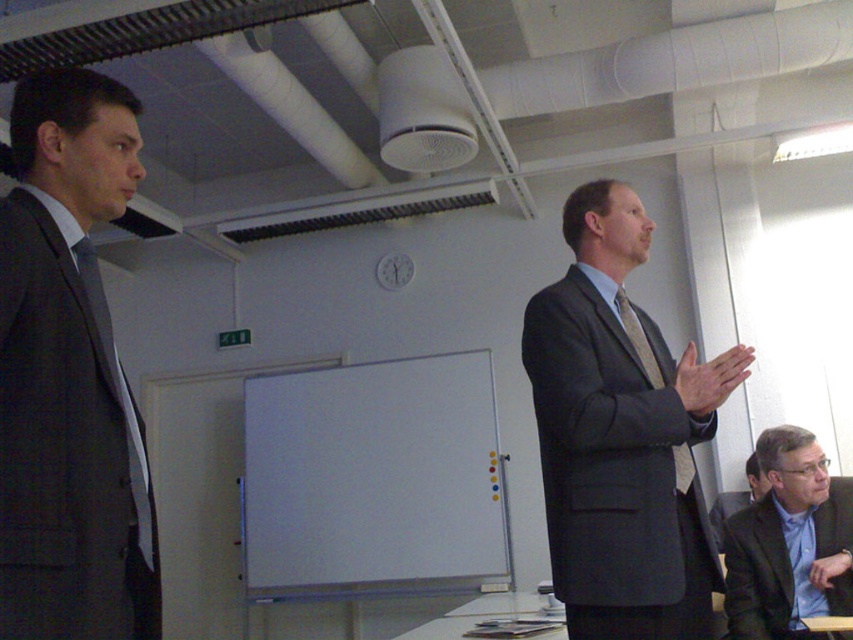
Question: Which object is positioned farthest from the matte gray suit at center?

Choices:
 (A) matte gray suit at left
 (B) dark gray suit at right

Answer: (B)

Question: Which of the following is the closest to the observer?

Choices:
 (A) (125, 628)
 (B) (753, 467)
 (C) (548, 477)
 (D) (787, 496)

Answer: (A)

Question: Can you confirm if matte gray suit at left is positioned below matte gray suit at center?

Choices:
 (A) no
 (B) yes

Answer: (A)

Question: Observing the image, what is the correct spatial positioning of matte gray suit at left in reference to matte gray suit at center?

Choices:
 (A) right
 (B) left

Answer: (B)

Question: Estimate the real-world distances between objects in this image. Which object is farther from the blue shirt at center?

Choices:
 (A) matte gray suit at center
 (B) matte gray suit at left
 (C) dark gray suit at right

Answer: (B)

Question: Does matte gray suit at left appear on the right side of blue shirt at center?

Choices:
 (A) yes
 (B) no

Answer: (B)